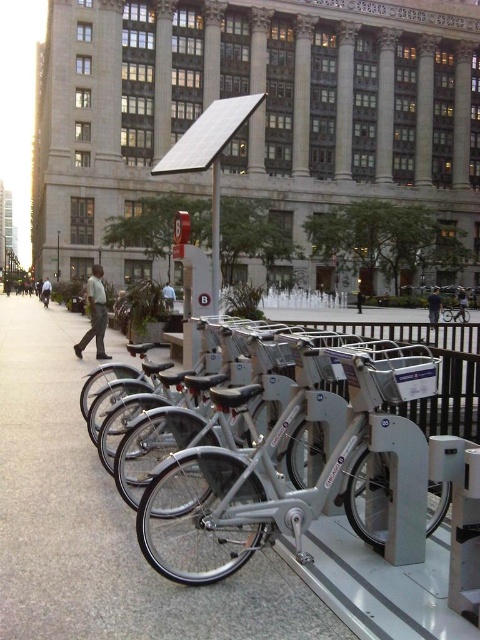
You are a delivery person who needs to secure your silver metallic bicycle at center to the silver metallic bicycle rack at center. The space between them is 1.61 meters. Is there enough space to maneuver your bicycle into the rack?

The silver metallic bicycle rack at center is 1.61 meters from the silver metallic bicycle at center. Since the distance between them is sufficient to allow maneuvering, you can move the bicycle into the rack easily.

You are a delivery person with a package that needs to be placed between the silver metallic bicycle rack at center and the dark gray pants at center. Can you fit the package there?

The silver metallic bicycle rack at center might be wider than dark gray pants at center, so the space between them may not be sufficient for the package.

You are a delivery person who needs to park your bike in the silver metallic bicycle rack at center. Your bike is exactly the same size as the silver metallic bicycle at center. Can you fit your bike into the rack?

The silver metallic bicycle rack at center is wider than the silver metallic bicycle at center, so yes, your bike will fit inside the rack.